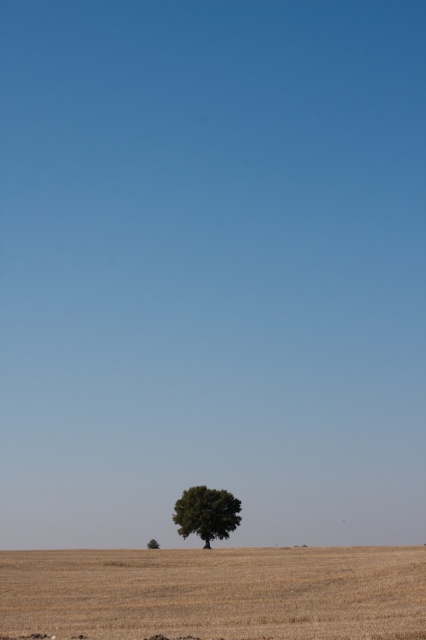
In the scene shown: Does brown dry grass at lower center appear on the left side of green leafy tree at lower center?

Incorrect, brown dry grass at lower center is not on the left side of green leafy tree at lower center.

Is brown dry grass at lower center wider than green leafy tree at lower center?

Yes, brown dry grass at lower center is wider than green leafy tree at lower center.

At what (x,y) coordinates should I click in order to perform the action: click on brown dry grass at lower center. Please return your answer as a coordinate pair (x, y). The width and height of the screenshot is (426, 640). Looking at the image, I should click on (215, 593).

Is green leafy tree at center positioned behind green leafy tree at lower center?

No, green leafy tree at center is in front of green leafy tree at lower center.

Can you confirm if green leafy tree at center is bigger than green leafy tree at lower center?

No.

This screenshot has height=640, width=426. Describe the element at coordinates (207, 513) in the screenshot. I see `green leafy tree at center` at that location.

This screenshot has width=426, height=640. What are the coordinates of `green leafy tree at center` in the screenshot? It's located at (207, 513).

Who is positioned more to the right, brown dry grass at lower center or green leafy tree at center?

brown dry grass at lower center is more to the right.

Is brown dry grass at lower center positioned before green leafy tree at center?

Yes, it is.

Does point (241, 572) lie in front of point (213, 502)?

Yes, point (241, 572) is closer to viewer.

Identify the location of brown dry grass at lower center. (215, 593).